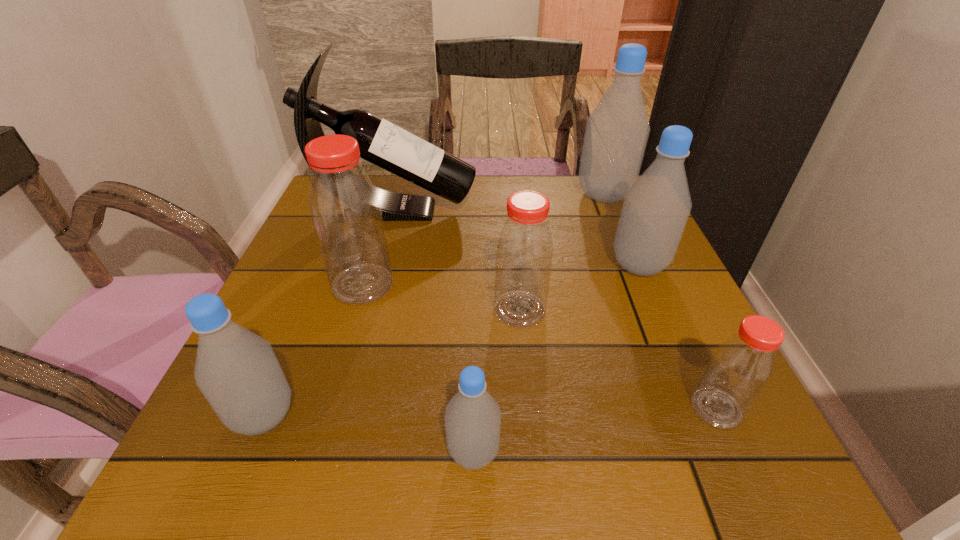
Identify the location of wine bottle at the left edge. (382, 143).

This screenshot has width=960, height=540. Find the location of `object that is at the far left corner`. object that is at the far left corner is located at coordinates (382, 143).

At what (x,y) coordinates should I click in order to perform the action: click on object that is positioned at the near left corner. Please return your answer as a coordinate pair (x, y). This screenshot has width=960, height=540. Looking at the image, I should click on (237, 371).

I want to click on object positioned at the far right corner, so (617, 130).

In the image, there is a desktop. Where is `blank space at the far edge`? This screenshot has width=960, height=540. blank space at the far edge is located at coordinates (474, 190).

The image size is (960, 540). In the image, there is a desktop. Identify the location of blank space at the near edge. (544, 459).

What are the coordinates of `blank space at the left edge of the desktop` in the screenshot? It's located at (305, 361).

Identify the location of vacant area at the right edge of the desktop. (616, 231).

Find the location of a particular element. The height and width of the screenshot is (540, 960). free space at the far right corner is located at coordinates (605, 213).

I want to click on vacant space that's between the rightmost red bottle and the biggest red bottle, so click(540, 346).